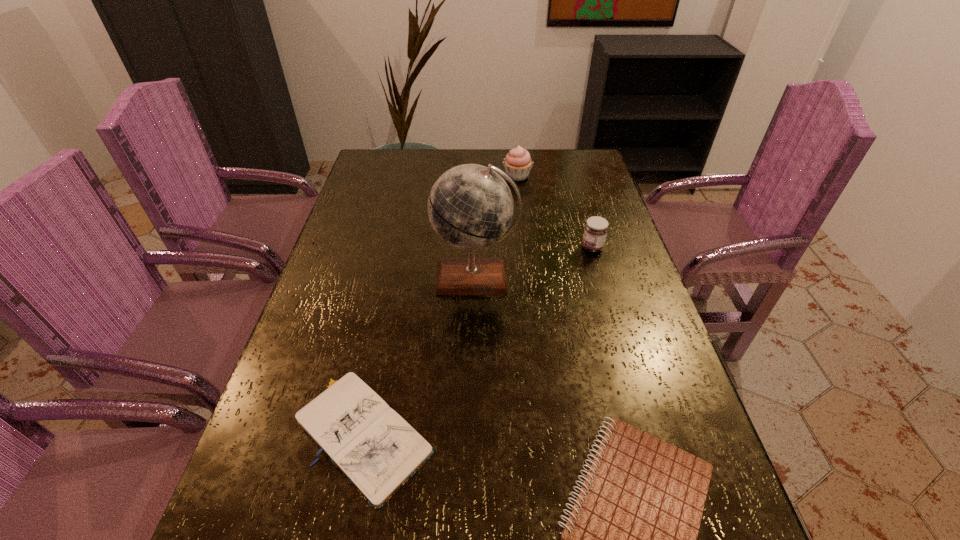
Where is `vacant space that is in between the tallest object and the left notebook`? Image resolution: width=960 pixels, height=540 pixels. vacant space that is in between the tallest object and the left notebook is located at coordinates (420, 355).

Locate which object is the fourth closest to the left notebook. Please provide its 2D coordinates. Your answer should be formatted as a tuple, i.e. [(x, y)], where the tuple contains the x and y coordinates of a point satisfying the conditions above.

[(517, 163)]

The image size is (960, 540). I want to click on object that is the fourth closest one to the right notebook, so click(x=517, y=163).

Image resolution: width=960 pixels, height=540 pixels. What are the coordinates of `free spot that satisfies the following two spatial constraints: 1. on the front label of the third shortest object; 2. at the equator of the globe` in the screenshot? It's located at (601, 278).

You are a GUI agent. You are given a task and a screenshot of the screen. Output one action in this format:
    pyautogui.click(x=<x>, y=<y>)
    Task: Click on the vacant space that satisfies the following two spatial constraints: 1. on the back side of the farthest object; 2. on the right side of the left notebook
    The height and width of the screenshot is (540, 960).
    Given the screenshot: What is the action you would take?
    pos(417,177)

Find the location of a particular element. This screenshot has height=540, width=960. vacant space that satisfies the following two spatial constraints: 1. on the front label of the third shortest object; 2. at the equator of the globe is located at coordinates (601, 278).

The width and height of the screenshot is (960, 540). I want to click on vacant space that satisfies the following two spatial constraints: 1. on the front label of the third tallest object; 2. at the equator of the globe, so click(x=601, y=278).